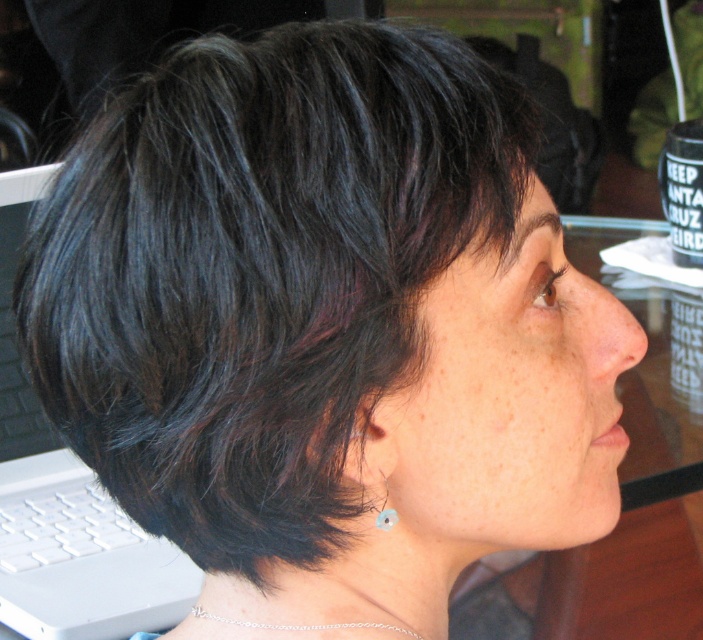
Who is positioned more to the left, silver chain necklace at lower center or pearl-like earring at lower center?

From the viewer's perspective, silver chain necklace at lower center appears more on the left side.

The image size is (703, 640). What are the coordinates of `silver chain necklace at lower center` in the screenshot? It's located at click(x=302, y=625).

Find the location of a particular element. Image resolution: width=703 pixels, height=640 pixels. silver chain necklace at lower center is located at coordinates (302, 625).

Does white plastic laptop at left appear over silver chain necklace at lower center?

Indeed, white plastic laptop at left is positioned over silver chain necklace at lower center.

Does point (56, 436) lie behind point (359, 621)?

That is True.

Where is `white plastic laptop at left`? white plastic laptop at left is located at coordinates (65, 500).

Is white plastic laptop at left to the left of pearl-like earring at lower center from the viewer's perspective?

Correct, you'll find white plastic laptop at left to the left of pearl-like earring at lower center.

Can you confirm if white plastic laptop at left is positioned above pearl-like earring at lower center?

No.

This screenshot has width=703, height=640. What are the coordinates of `white plastic laptop at left` in the screenshot? It's located at (65, 500).